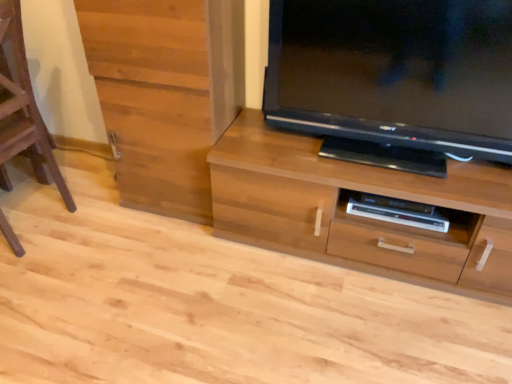
Question: Is wooden cabinet at left facing away from wooden chest of drawers at center?

Choices:
 (A) yes
 (B) no

Answer: (B)

Question: Is wooden cabinet at left placed right next to wooden chest of drawers at center?

Choices:
 (A) yes
 (B) no

Answer: (B)

Question: Can you confirm if wooden cabinet at left is taller than wooden chest of drawers at center?

Choices:
 (A) yes
 (B) no

Answer: (A)

Question: Could wooden chest of drawers at center be considered to be inside wooden cabinet at left?

Choices:
 (A) no
 (B) yes

Answer: (A)

Question: Would you say wooden cabinet at left is a long distance from wooden chest of drawers at center?

Choices:
 (A) no
 (B) yes

Answer: (A)

Question: Is satin wood shelf at lower center to the left or to the right of wooden chest of drawers at center in the image?

Choices:
 (A) right
 (B) left

Answer: (A)

Question: Is satin wood shelf at lower center situated inside wooden chest of drawers at center or outside?

Choices:
 (A) inside
 (B) outside

Answer: (A)

Question: Does point (415, 231) appear closer or farther from the camera than point (292, 162)?

Choices:
 (A) farther
 (B) closer

Answer: (A)

Question: From a real-world perspective, relative to wooden chest of drawers at center, is satin wood shelf at lower center vertically above or below?

Choices:
 (A) above
 (B) below

Answer: (A)

Question: Considering the relative positions of wooden cabinet at left and wooden chest of drawers at center in the image provided, is wooden cabinet at left to the left or to the right of wooden chest of drawers at center?

Choices:
 (A) right
 (B) left

Answer: (B)

Question: Is point (122, 129) positioned closer to the camera than point (281, 144)?

Choices:
 (A) farther
 (B) closer

Answer: (A)

Question: Considering the positions of wooden cabinet at left and wooden chest of drawers at center in the image, is wooden cabinet at left wider or thinner than wooden chest of drawers at center?

Choices:
 (A) wide
 (B) thin

Answer: (B)

Question: Based on their sizes in the image, would you say wooden cabinet at left is bigger or smaller than wooden chest of drawers at center?

Choices:
 (A) big
 (B) small

Answer: (B)

Question: In terms of height, does brown wooden stool at left look taller or shorter compared to black glossy television at upper right?

Choices:
 (A) short
 (B) tall

Answer: (B)

Question: Is brown wooden stool at left wider or thinner than black glossy television at upper right?

Choices:
 (A) thin
 (B) wide

Answer: (B)